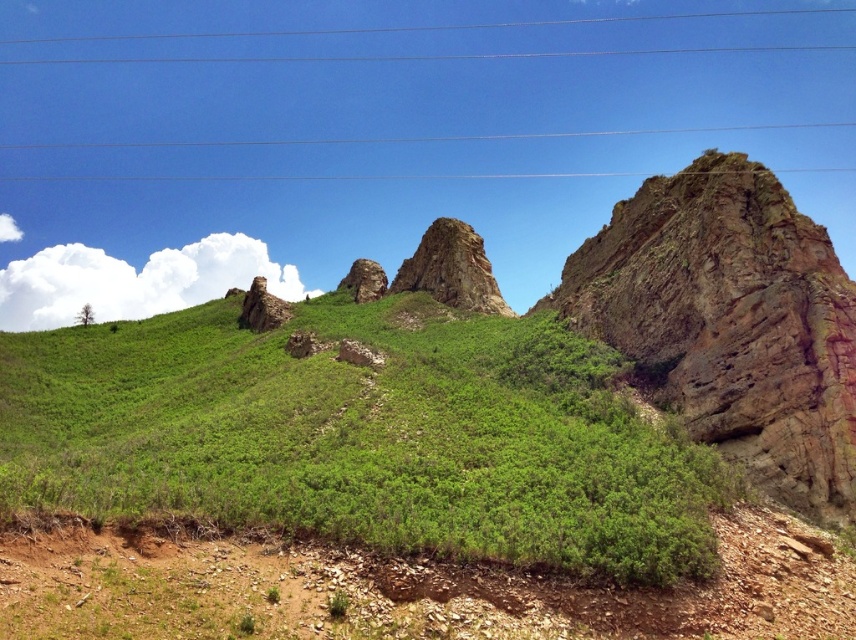
Looking at this image, you are a hiker trying to navigate the rugged terrain. You notice metallic wires at upper center and a rusty rock formation at center. Which object would be more challenging to step over due to its size?

The metallic wires at upper center are larger in size compared to the rusty rock formation at center, making them more challenging to step over.

A hiker is standing at the base of the steep rocky slope in the midground and wants to reach the green leafy grass at center. The hiker has a 1.5 meter long hiking pole. If the hiker places the pole horizontally between the two points, will the pole reach the grass?

The distance between the base of the steep rocky slope in the midground and the green leafy grass at center is 47.16 meters. Since the hiking pole is only 1.5 meters long, it will not reach the grass.

You are a hiker who wants to place a small tent on the ground. You have two options for placement near the green leafy grass at center and the rusty rock formation at center. Which location would provide more space for the tent?

The green leafy grass at center is larger in size than the rusty rock formation at center, so placing the tent near the green leafy grass at center would provide more space.